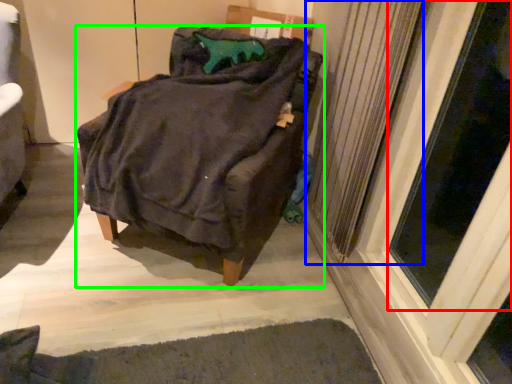
Question: Which is farther away from screen door (highlighted by a red box)? radiator (highlighted by a blue box) or furniture (highlighted by a green box)?

Choices:
 (A) radiator
 (B) furniture

Answer: (B)